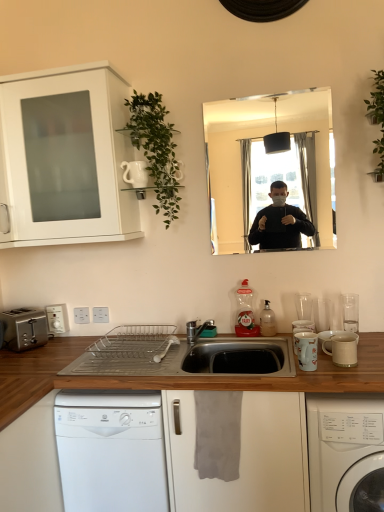
The height and width of the screenshot is (512, 384). Find the location of `vacant space that is to the left of white ceramic mug at right, which is counted as the first appliance, starting from the bottom`. vacant space that is to the left of white ceramic mug at right, which is counted as the first appliance, starting from the bottom is located at coordinates (306, 371).